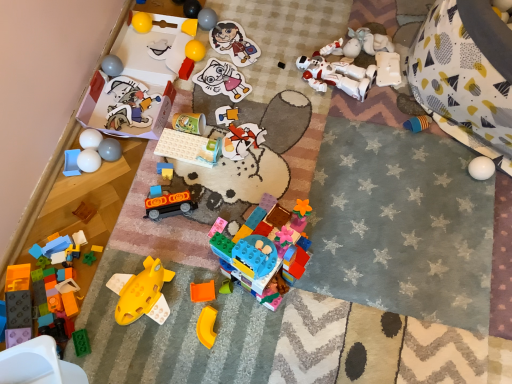
Where is `free space to the back side of translucent orange plastic at center, the fifth toy in the right-to-left sequence`? free space to the back side of translucent orange plastic at center, the fifth toy in the right-to-left sequence is located at coordinates (207, 231).